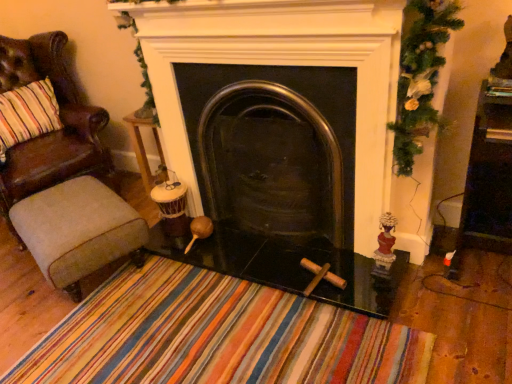
Question: From a real-world perspective, is beige fabric stool at lower left on top of green textured garland at upper right?

Choices:
 (A) no
 (B) yes

Answer: (A)

Question: From the image's perspective, would you say beige fabric stool at lower left is positioned over green textured garland at upper right?

Choices:
 (A) no
 (B) yes

Answer: (A)

Question: Considering the relative positions of beige fabric stool at lower left and green textured garland at upper right in the image provided, is beige fabric stool at lower left behind green textured garland at upper right?

Choices:
 (A) no
 (B) yes

Answer: (B)

Question: Is beige fabric stool at lower left oriented towards green textured garland at upper right?

Choices:
 (A) no
 (B) yes

Answer: (A)

Question: Considering the relative sizes of beige fabric stool at lower left and green textured garland at upper right in the image provided, is beige fabric stool at lower left bigger than green textured garland at upper right?

Choices:
 (A) no
 (B) yes

Answer: (B)

Question: From the image's perspective, is brown leather chair at left above or below transparent glass table at center?

Choices:
 (A) below
 (B) above

Answer: (B)

Question: Do you think brown leather chair at left is within transparent glass table at center, or outside of it?

Choices:
 (A) inside
 (B) outside

Answer: (B)

Question: In the image, is brown leather chair at left positioned in front of or behind transparent glass table at center?

Choices:
 (A) front
 (B) behind

Answer: (B)

Question: In terms of height, does brown leather chair at left look taller or shorter compared to transparent glass table at center?

Choices:
 (A) tall
 (B) short

Answer: (A)

Question: Would you say matte red figurine at right is to the left or to the right of black glass fireplace at center in the picture?

Choices:
 (A) left
 (B) right

Answer: (B)

Question: From a real-world perspective, relative to black glass fireplace at center, is matte red figurine at right vertically above or below?

Choices:
 (A) above
 (B) below

Answer: (B)

Question: Considering their positions, is matte red figurine at right located in front of or behind black glass fireplace at center?

Choices:
 (A) front
 (B) behind

Answer: (B)

Question: Considering the positions of matte red figurine at right and black glass fireplace at center in the image, is matte red figurine at right bigger or smaller than black glass fireplace at center?

Choices:
 (A) small
 (B) big

Answer: (A)

Question: From a real-world perspective, is green textured garland at upper right positioned above or below wooden side table at center?

Choices:
 (A) above
 (B) below

Answer: (A)

Question: Is green textured garland at upper right wider or thinner than wooden side table at center?

Choices:
 (A) wide
 (B) thin

Answer: (B)